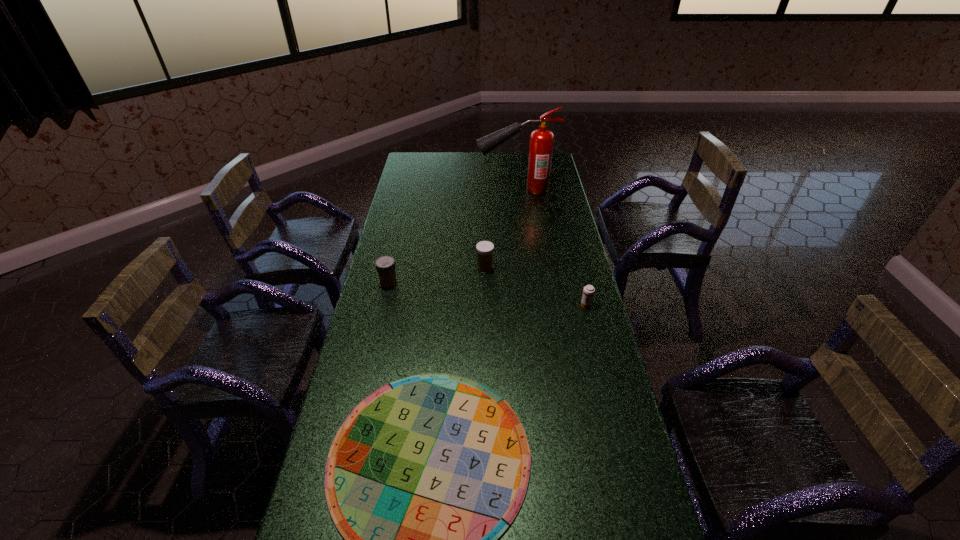
The image size is (960, 540). I want to click on the farthest object, so click(x=541, y=140).

Find the location of a particular element. The image size is (960, 540). the tallest object is located at coordinates (541, 140).

Locate an element on the screen. Image resolution: width=960 pixels, height=540 pixels. the farthest medicine is located at coordinates (485, 249).

What are the coordinates of `the second farthest object` in the screenshot? It's located at (485, 249).

Find the location of a particular element. the third farthest object is located at coordinates (385, 265).

Find the location of a particular element. This screenshot has width=960, height=540. the leftmost medicine is located at coordinates (385, 265).

Image resolution: width=960 pixels, height=540 pixels. I want to click on the rightmost medicine, so click(x=588, y=292).

Find the location of a particular element. The image size is (960, 540). the fourth farthest object is located at coordinates (588, 292).

At what (x,y) coordinates should I click in order to perform the action: click on free space located 0.300m at the nozzle of the farthest object. Please return your answer as a coordinate pair (x, y). The width and height of the screenshot is (960, 540). Looking at the image, I should click on (416, 189).

The image size is (960, 540). Identify the location of vacant space located 0.070m at the nozzle of the farthest object. (463, 189).